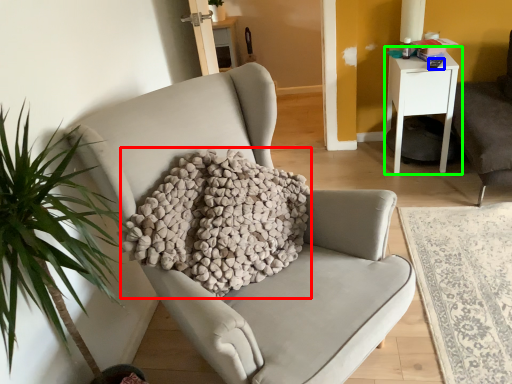
Question: Which object is positioned closest to pillow (highlighted by a red box)? Select from remote control (highlighted by a blue box) and nightstand (highlighted by a green box).

Choices:
 (A) remote control
 (B) nightstand

Answer: (B)